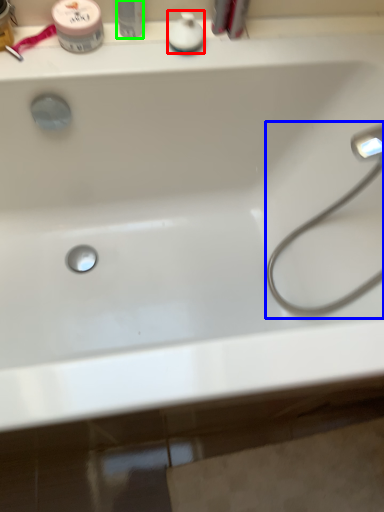
Question: Which object is the farthest from toiletry (highlighted by a red box)? Choose among these: faucet (highlighted by a blue box) or toiletry (highlighted by a green box).

Choices:
 (A) faucet
 (B) toiletry

Answer: (A)